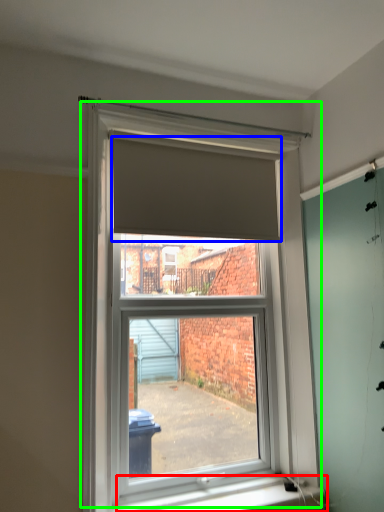
Question: Which object is the farthest from window sill (highlighted by a red box)? Choose among these: blind (highlighted by a blue box) or window (highlighted by a green box).

Choices:
 (A) blind
 (B) window

Answer: (A)